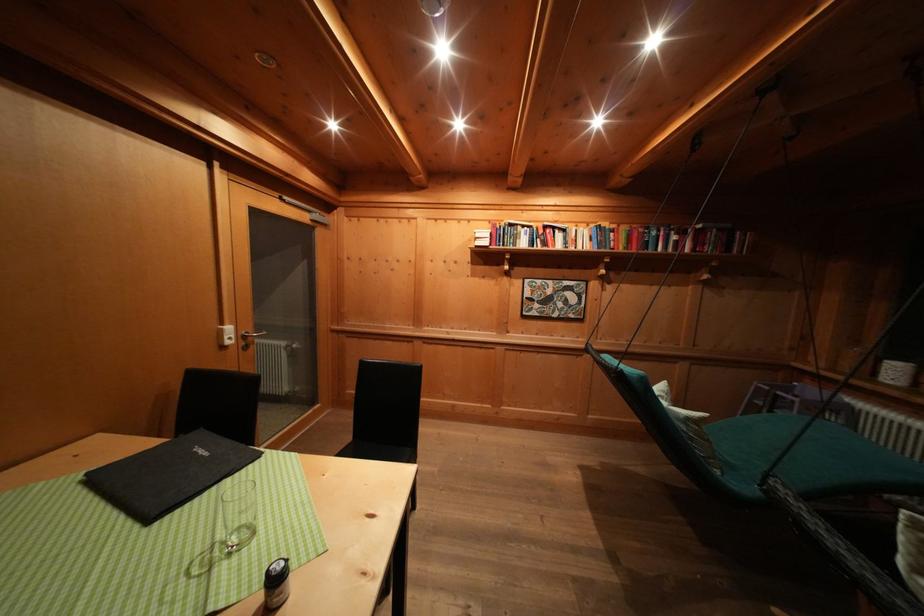
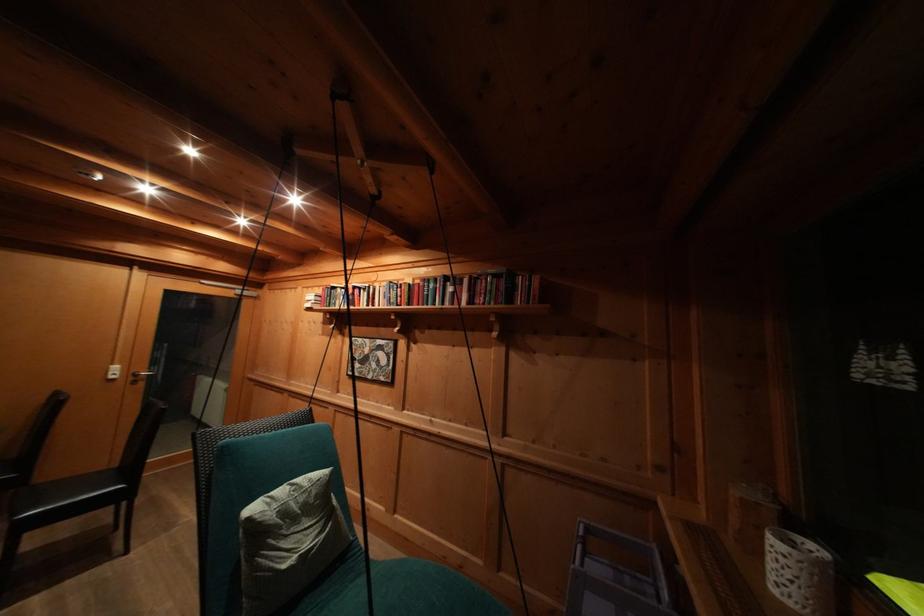
In the second image, find the point that corresponds to the point at 442,225 in the first image.

(313, 293)